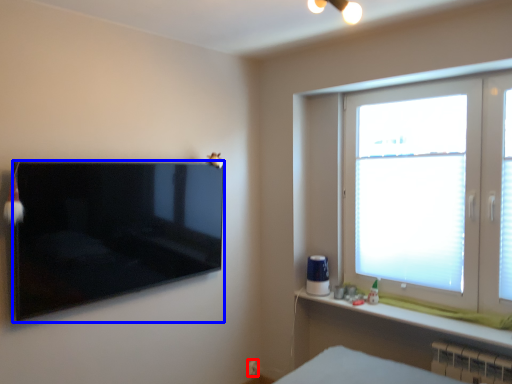
Question: Which object appears closest to the camera in this image, electric outlet (highlighted by a red box) or television (highlighted by a blue box)?

Choices:
 (A) electric outlet
 (B) television

Answer: (B)